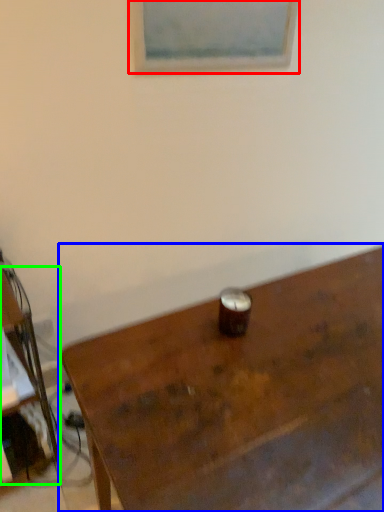
Question: Considering the real-world distances, which object is farthest from picture frame (highlighted by a red box)? table (highlighted by a blue box) or desk (highlighted by a green box)?

Choices:
 (A) table
 (B) desk

Answer: (B)